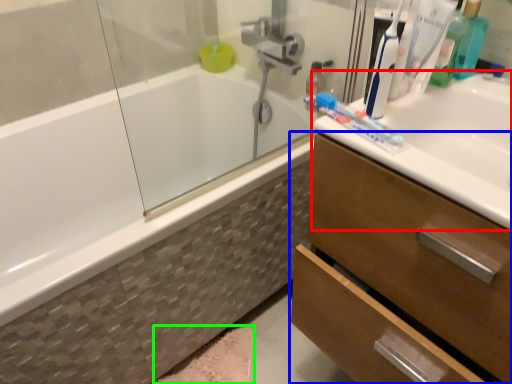
Question: Which is farther away from sink (highlighted by a red box)? bathroom cabinet (highlighted by a blue box) or bath mat (highlighted by a green box)?

Choices:
 (A) bathroom cabinet
 (B) bath mat

Answer: (B)